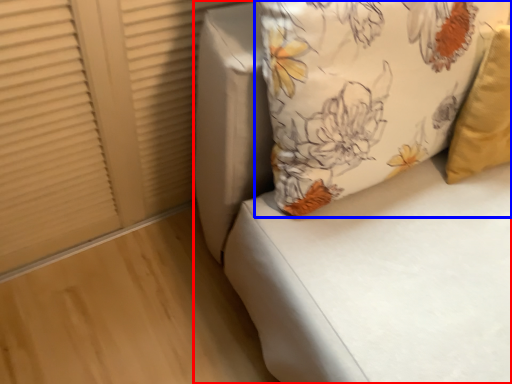
Question: Which object appears closest to the camera in this image, furniture (highlighted by a red box) or pillow (highlighted by a blue box)?

Choices:
 (A) furniture
 (B) pillow

Answer: (A)